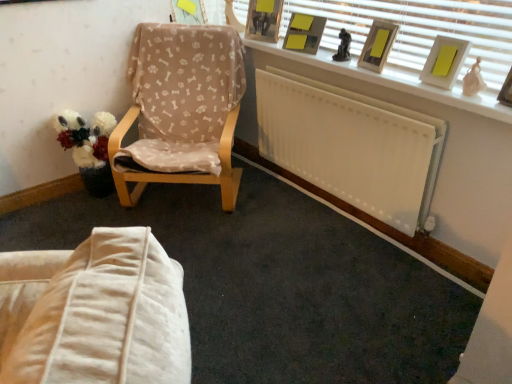
Question: Can you confirm if matte wooden picture frame at upper right, the third picture frame positioned from the right, is taller than matte yellow picture frame at upper center, the sixth picture frame when ordered from right to left?

Choices:
 (A) yes
 (B) no

Answer: (A)

Question: Is matte wooden picture frame at upper right, placed as the 3th picture frame when sorted from front to back, facing away from matte yellow picture frame at upper center, the 6th picture frame in the front-to-back sequence?

Choices:
 (A) no
 (B) yes

Answer: (A)

Question: Is matte wooden picture frame at upper right, the fourth picture frame when ordered from back to front, located outside matte yellow picture frame at upper center, placed as the first picture frame when sorted from left to right?

Choices:
 (A) no
 (B) yes

Answer: (B)

Question: Can you confirm if matte wooden picture frame at upper right, marked as the 4th picture frame in a left-to-right arrangement, is shorter than matte yellow picture frame at upper center, the 6th picture frame in the front-to-back sequence?

Choices:
 (A) yes
 (B) no

Answer: (B)

Question: Is matte wooden picture frame at upper right, the fourth picture frame when ordered from back to front, positioned in front of matte yellow picture frame at upper center, placed as the first picture frame when sorted from left to right?

Choices:
 (A) no
 (B) yes

Answer: (B)

Question: Does matte wooden picture frame at upper right, the fourth picture frame when ordered from back to front, appear on the left side of matte yellow picture frame at upper center, the 6th picture frame in the front-to-back sequence?

Choices:
 (A) yes
 (B) no

Answer: (B)

Question: Is wooden picture frame at upper center, acting as the second picture frame starting from the back, to the left of beige fabric chair at left from the viewer's perspective?

Choices:
 (A) no
 (B) yes

Answer: (A)

Question: Does wooden picture frame at upper center, which is counted as the 2th picture frame, starting from the left, have a greater width compared to beige fabric chair at left?

Choices:
 (A) no
 (B) yes

Answer: (A)

Question: Can you confirm if wooden picture frame at upper center, which is counted as the 2th picture frame, starting from the left, is smaller than beige fabric chair at left?

Choices:
 (A) no
 (B) yes

Answer: (B)

Question: Would you say wooden picture frame at upper center, acting as the second picture frame starting from the back, contains beige fabric chair at left?

Choices:
 (A) yes
 (B) no

Answer: (B)

Question: Is wooden picture frame at upper center, which is counted as the 2th picture frame, starting from the left, next to beige fabric chair at left and touching it?

Choices:
 (A) yes
 (B) no

Answer: (B)

Question: From the image's perspective, is wooden picture frame at upper center, which is counted as the 2th picture frame, starting from the left, over beige fabric chair at left?

Choices:
 (A) yes
 (B) no

Answer: (A)

Question: Does beige fabric chair at left have a greater width compared to wooden picture frame at upper right, positioned as the 1th picture frame in right-to-left order?

Choices:
 (A) yes
 (B) no

Answer: (A)